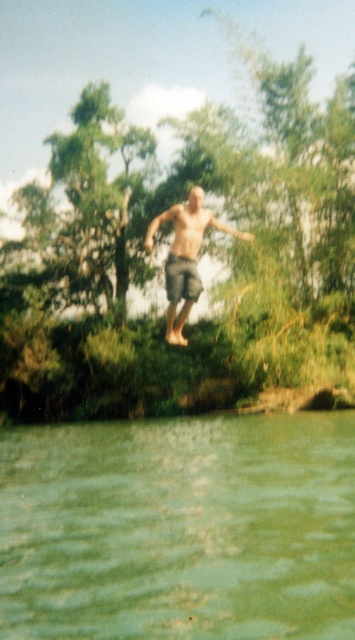
Question: Can you confirm if green murky water at lower center is smaller than gray cotton shorts at center?

Choices:
 (A) yes
 (B) no

Answer: (A)

Question: From the image, what is the correct spatial relationship of green murky water at lower center in relation to gray cotton shorts at center?

Choices:
 (A) left
 (B) right

Answer: (A)

Question: Which object is farther from the camera taking this photo?

Choices:
 (A) green murky water at lower center
 (B) gray cotton shorts at center

Answer: (B)

Question: Which point is farther to the camera?

Choices:
 (A) gray cotton shorts at center
 (B) green murky water at lower center

Answer: (A)

Question: Is green murky water at lower center positioned before gray cotton shorts at center?

Choices:
 (A) yes
 (B) no

Answer: (A)

Question: Which point is farther to the camera?

Choices:
 (A) green murky water at lower center
 (B) gray cotton shorts at center

Answer: (B)